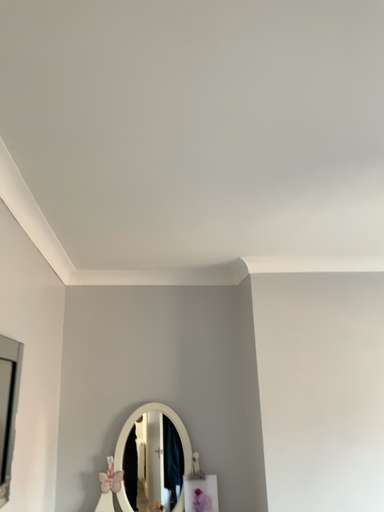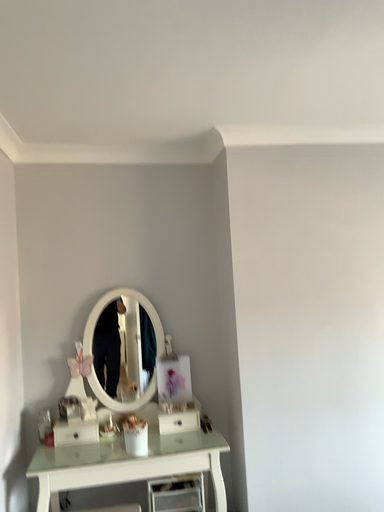
Question: Which way did the camera rotate in the video?

Choices:
 (A) rotated upward
 (B) rotated downward

Answer: (B)